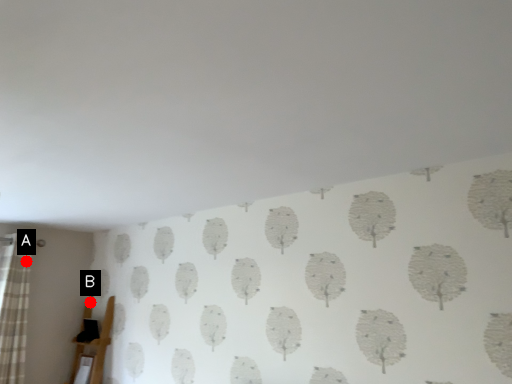
Question: Two points are circled on the image, labeled by A and B beside each circle. Which of the following is the farthest from the observer?

Choices:
 (A) A is further
 (B) B is further

Answer: (B)